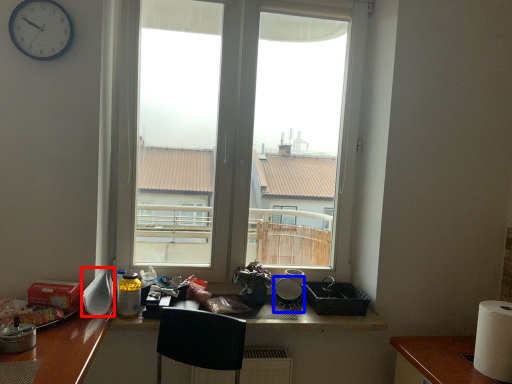
Question: Which of the following is the farthest to the observer, appliance (highlighted by a red box) or appliance (highlighted by a blue box)?

Choices:
 (A) appliance
 (B) appliance

Answer: (B)